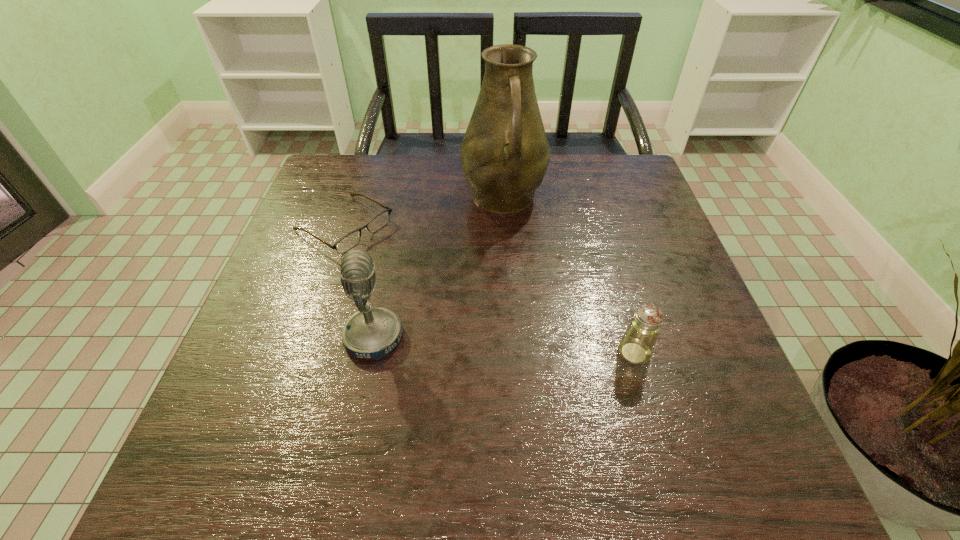
Locate an element on the screen. vacant space at the near edge of the desktop is located at coordinates (430, 410).

This screenshot has height=540, width=960. I want to click on free region at the left edge of the desktop, so click(x=303, y=278).

The width and height of the screenshot is (960, 540). In the image, there is a desktop. Find the location of `free space at the right edge`. free space at the right edge is located at coordinates (660, 348).

This screenshot has height=540, width=960. What are the coordinates of `vacant space at the far left corner` in the screenshot? It's located at (355, 158).

Where is `vacant area at the near right corner`? vacant area at the near right corner is located at coordinates (737, 402).

Image resolution: width=960 pixels, height=540 pixels. In order to click on free space between the tallest object and the second shortest object in this screenshot , I will do `click(568, 275)`.

What are the coordinates of `free space between the second shortest object and the third shortest object` in the screenshot? It's located at (504, 345).

In order to click on blank region between the second object from right to left and the shortest object in this screenshot , I will do `click(424, 212)`.

The image size is (960, 540). What are the coordinates of `free space between the tallest object and the third shortest object` in the screenshot? It's located at pyautogui.click(x=439, y=268).

Identify the location of vacant area between the tallest object and the spectacles. The image size is (960, 540). coord(424,212).